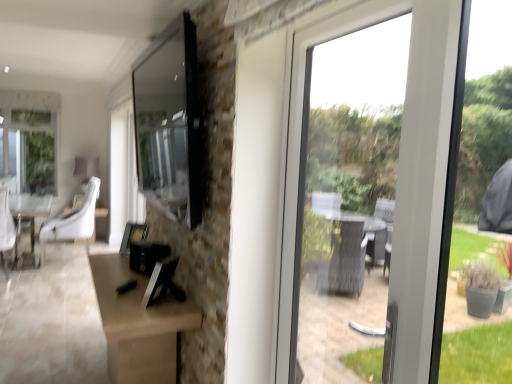
I want to click on white leather swivel chair at left, so click(6, 230).

Where is `matte black tv at upper center`? Image resolution: width=512 pixels, height=384 pixels. matte black tv at upper center is located at coordinates (169, 122).

Where is `white leather swivel chair at left`? white leather swivel chair at left is located at coordinates pyautogui.click(x=6, y=230).

What's the angular difference between white fabric chair at center and matte black tv at upper center's facing directions?

They differ by 1.1 degrees in their facing directions.

Does white fabric chair at center have a smaller size compared to matte black tv at upper center?

Actually, white fabric chair at center might be larger than matte black tv at upper center.

Between point (45, 237) and point (167, 60), which one is positioned behind?

Point (45, 237)

Is white fabric chair at center surrounding matte black tv at upper center?

No, matte black tv at upper center is located outside of white fabric chair at center.

You are a GUI agent. You are given a task and a screenshot of the screen. Output one action in this format:
    pyautogui.click(x=<x>, y=<y>)
    Task: Click on the chair behind the matte black tv at upper center
    The height and width of the screenshot is (384, 512).
    Given the screenshot: What is the action you would take?
    pyautogui.click(x=73, y=221)

What's the angular difference between matte black tv at upper center and white fabric chair at center's facing directions?

The angle between the facing direction of matte black tv at upper center and the facing direction of white fabric chair at center is 1.1 degrees.

Which of these two, matte black tv at upper center or white fabric chair at center, is wider?

white fabric chair at center is wider.

Can you see matte black tv at upper center touching white fabric chair at center?

There is a gap between matte black tv at upper center and white fabric chair at center.

Is white leather swivel chair at left far from matte black tv at upper center?

white leather swivel chair at left is positioned a significant distance from matte black tv at upper center.

In terms of height, does white leather swivel chair at left look taller or shorter compared to matte black tv at upper center?

Considering their sizes, white leather swivel chair at left has more height than matte black tv at upper center.

Could matte black tv at upper center be considered to be inside white leather swivel chair at left?

No, matte black tv at upper center is not a part of white leather swivel chair at left.

What's the angular difference between white leather swivel chair at left and matte black tv at upper center's facing directions?

88.9 degrees.

From the image's perspective, which one is positioned lower, white fabric chair at center or white leather swivel chair at left?

white leather swivel chair at left is shown below in the image.

Is white fabric chair at center facing away from white leather swivel chair at left?

white fabric chair at center does not have its back to white leather swivel chair at left.

From their relative heights in the image, would you say white fabric chair at center is taller or shorter than white leather swivel chair at left?

Clearly, white fabric chair at center is shorter compared to white leather swivel chair at left.

Between point (86, 251) and point (2, 200), which one is positioned in front?

The point (86, 251) is closer.

How many degrees apart are the facing directions of white leather swivel chair at left and white fabric chair at center?

The angular difference between white leather swivel chair at left and white fabric chair at center is 90 degrees.

Is white leather swivel chair at left oriented away from white fabric chair at center?

No, white leather swivel chair at left is not facing the opposite direction of white fabric chair at center.

Considering the sizes of white leather swivel chair at left and white fabric chair at center in the image, is white leather swivel chair at left bigger or smaller than white fabric chair at center?

white leather swivel chair at left is smaller than white fabric chair at center.

Consider the image. Considering the relative sizes of white leather swivel chair at left and white fabric chair at center in the image provided, is white leather swivel chair at left thinner than white fabric chair at center?

Yes.

Is matte black tv at upper center in contact with white leather swivel chair at left?

No, matte black tv at upper center is not with white leather swivel chair at left.

From a real-world perspective, is matte black tv at upper center above or below white leather swivel chair at left?

In terms of real-world spatial position, matte black tv at upper center is above white leather swivel chair at left.

How different are the orientations of matte black tv at upper center and white leather swivel chair at left in degrees?

The angular difference between matte black tv at upper center and white leather swivel chair at left is 88.9 degrees.

Considering the relative sizes of matte black tv at upper center and white leather swivel chair at left in the image provided, is matte black tv at upper center thinner than white leather swivel chair at left?

Indeed, matte black tv at upper center has a lesser width compared to white leather swivel chair at left.

You are a GUI agent. You are given a task and a screenshot of the screen. Output one action in this format:
    pyautogui.click(x=<x>, y=<y>)
    Task: Click on the window screen in front of the white fabric chair at center
    The image size is (512, 384).
    Given the screenshot: What is the action you would take?
    click(x=169, y=122)

Locate an element on the screen. The image size is (512, 384). window screen above the white fabric chair at center (from the image's perspective) is located at coordinates (169, 122).

Which object lies further to the anchor point white leather swivel chair at left, matte black tv at upper center or white fabric chair at center?

matte black tv at upper center.

From the image, which object appears to be nearer to white leather swivel chair at left, white fabric chair at center or matte black tv at upper center?

Among the two, white fabric chair at center is located nearer to white leather swivel chair at left.

Based on their spatial positions, is white leather swivel chair at left or white fabric chair at center further from matte black tv at upper center?

white leather swivel chair at left is further to matte black tv at upper center.

Looking at this image, estimate the real-world distances between objects in this image. Which object is further from white fabric chair at center, matte black tv at upper center or white leather swivel chair at left?

matte black tv at upper center lies further to white fabric chair at center than the other object.

From the image, which object appears to be nearer to matte black tv at upper center, white fabric chair at center or white leather swivel chair at left?

Based on the image, white fabric chair at center appears to be nearer to matte black tv at upper center.

Based on their spatial positions, is white leather swivel chair at left or matte black tv at upper center further from white fabric chair at center?

matte black tv at upper center is further to white fabric chair at center.

This screenshot has height=384, width=512. Identify the location of swivel chair between matte black tv at upper center and white fabric chair at center from front to back. (6, 230).